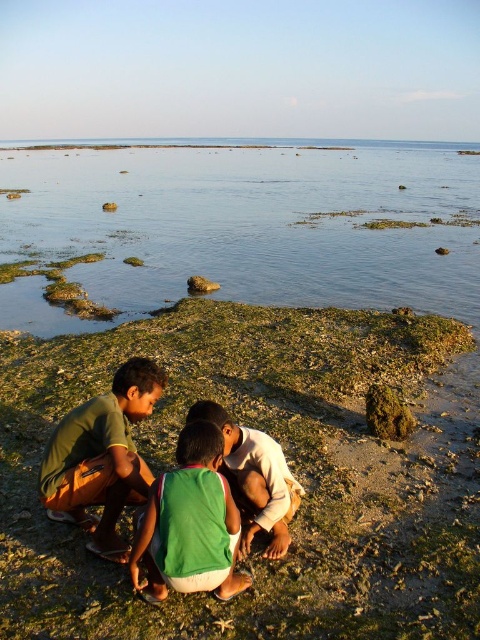
Who is more forward, (228, 440) or (204, 276)?

Point (228, 440) is in front.

Which is behind, point (256, 508) or point (196, 292)?

The point (196, 292) is behind.

Is point (264, 461) in front of point (201, 284)?

Yes, point (264, 461) is closer to viewer.

The height and width of the screenshot is (640, 480). In order to click on green fabric shirt at center in this screenshot , I will do `click(254, 477)`.

Who is positioned more to the left, clear water at center or green cotton shirt at lower left?

From the viewer's perspective, green cotton shirt at lower left appears more on the left side.

Does clear water at center have a lesser width compared to green cotton shirt at lower left?

No.

Identify the location of clear water at center. (253, 224).

I want to click on clear water at center, so click(253, 224).

Between green jersey at center and brown rough rock at center, which one is positioned higher?

Positioned higher is brown rough rock at center.

Can you confirm if green jersey at center is bigger than brown rough rock at center?

Indeed, green jersey at center has a larger size compared to brown rough rock at center.

The height and width of the screenshot is (640, 480). What do you see at coordinates (190, 524) in the screenshot?
I see `green jersey at center` at bounding box center [190, 524].

The height and width of the screenshot is (640, 480). What are the coordinates of `green jersey at center` in the screenshot? It's located at (190, 524).